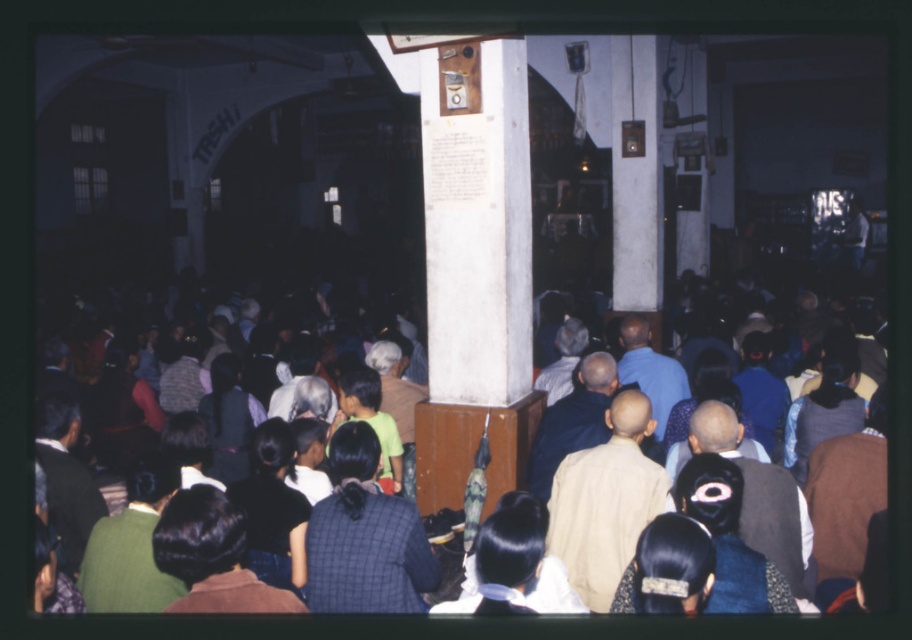
You are organizing a photo shoot and need to ensure that two participants, one wearing a light beige fabric shirt at center and the other in a dark brown vest at center, can sit side by side on a bench that is 1.2 meters wide. Based on the scene description, will they fit comfortably?

The light beige fabric shirt at center has a larger width than the dark brown vest at center. Since the bench is 1.2 meters wide, they should fit comfortably as long as the combined width of both individuals does not exceed the bench length. However, the exact dimensions of their widths are not provided, so this depends on their actual sizes.